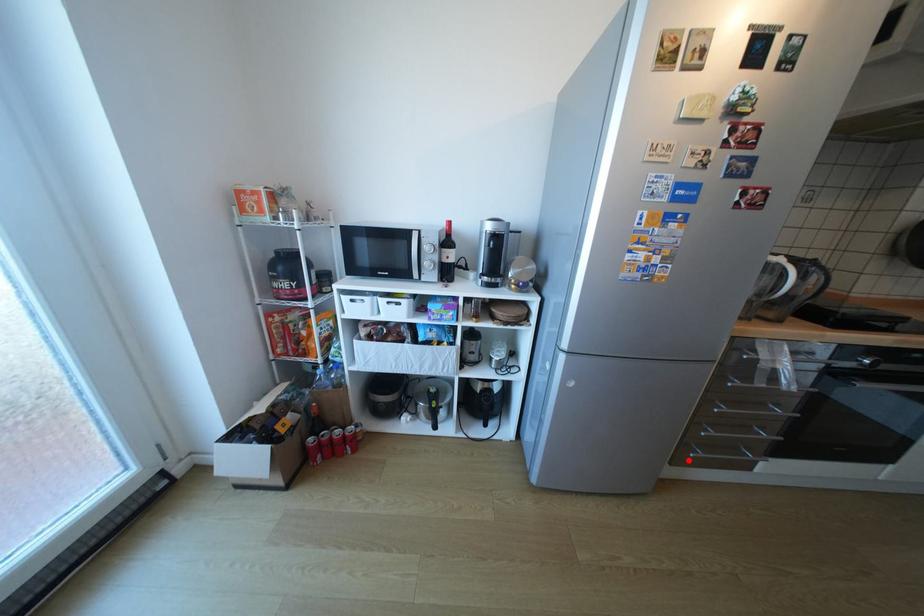
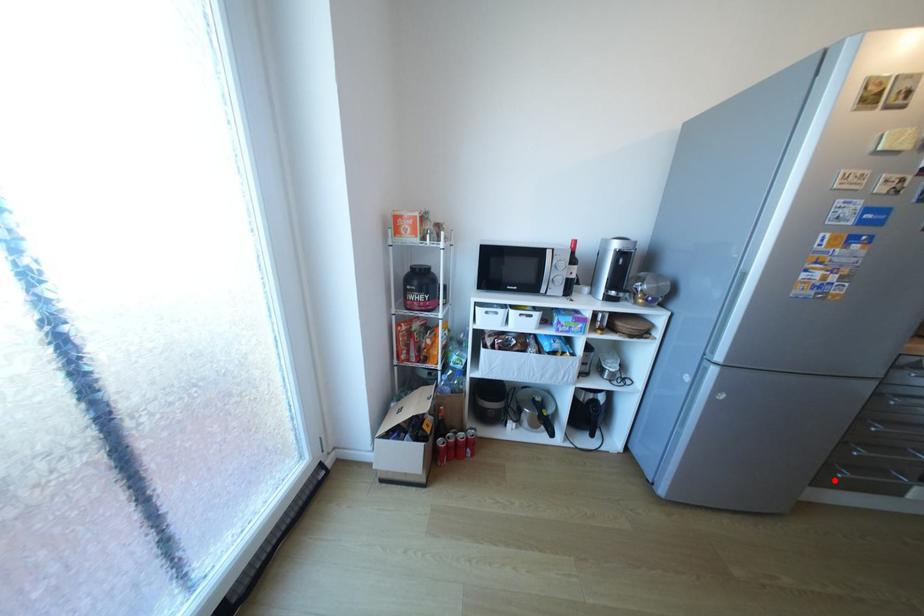
I am providing you with two images of the same scene from different viewpoints. A red point is marked on the first image and another point is marked on the second image. Does the point marked in image1 correspond to the same location as the one in image2?

Yes